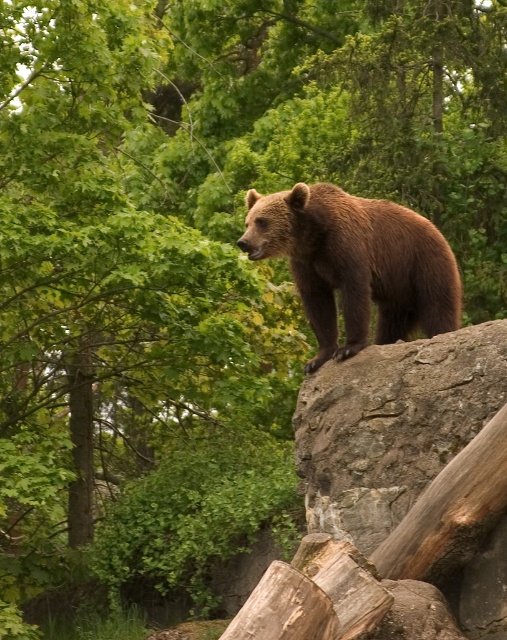
Can you confirm if rough textured rock at upper center is bigger than brown furry bear at center?

No.

Between rough textured rock at upper center and brown furry bear at center, which one is positioned lower?

Positioned lower is rough textured rock at upper center.

I want to click on rough textured rock at upper center, so (x=391, y=426).

You are a GUI agent. You are given a task and a screenshot of the screen. Output one action in this format:
    pyautogui.click(x=<x>, y=<y>)
    Task: Click on the rough textured rock at upper center
    The width and height of the screenshot is (507, 640).
    Given the screenshot: What is the action you would take?
    pyautogui.click(x=391, y=426)